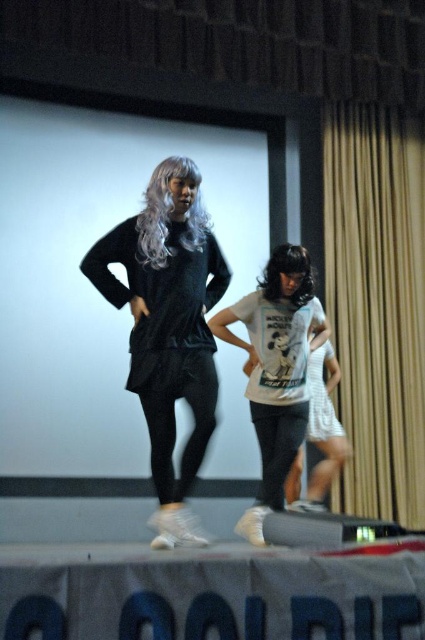
Question: Does white cotton t-shirt at center come behind white matte shirt at center?

Choices:
 (A) no
 (B) yes

Answer: (A)

Question: Can you confirm if matte gold curtain at right is smaller than matte black dress at center?

Choices:
 (A) no
 (B) yes

Answer: (A)

Question: Which of the following is the closest to the observer?

Choices:
 (A) matte black dress at center
 (B) gray synthetic wig at center

Answer: (A)

Question: Does matte black dress at center appear on the left side of dark brown silky hair at center?

Choices:
 (A) no
 (B) yes

Answer: (B)

Question: Which point is farther to the camera?

Choices:
 (A) white matte shirt at center
 (B) white cotton t-shirt at center
 (C) dark brown silky hair at center

Answer: (A)

Question: Among these points, which one is farthest from the camera?

Choices:
 (A) [x=367, y=182]
 (B) [x=173, y=168]
 (C) [x=178, y=253]
 (D) [x=317, y=394]

Answer: (A)